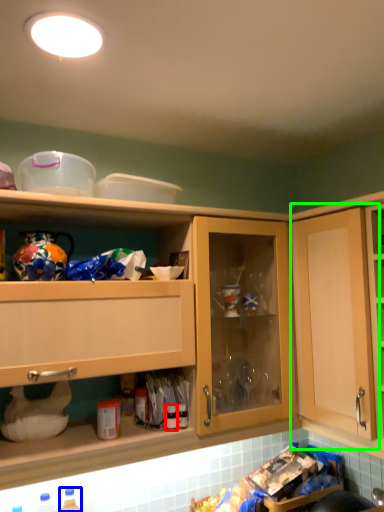
Question: Which object is the closest to the bottle (highlighted by a red box)? Choose among these: bottle (highlighted by a blue box) or cabinetry (highlighted by a green box).

Choices:
 (A) bottle
 (B) cabinetry

Answer: (A)